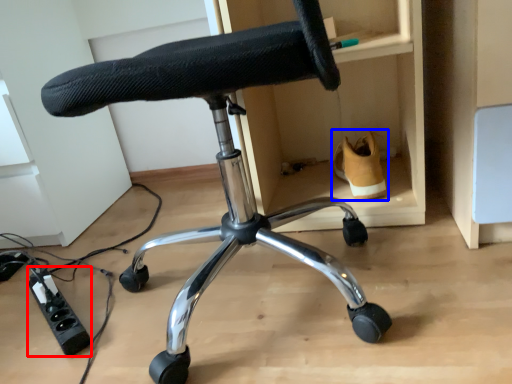
Question: Which point is closer to the camera, plug (highlighted by a red box) or footwear (highlighted by a blue box)?

Choices:
 (A) plug
 (B) footwear

Answer: (A)